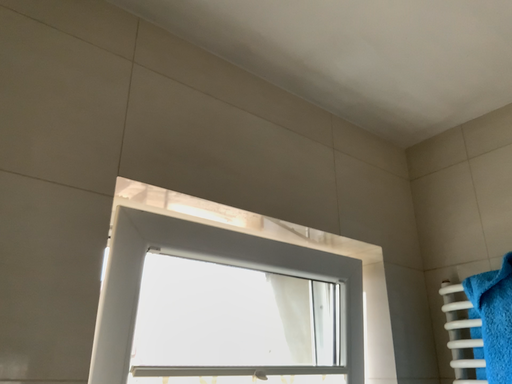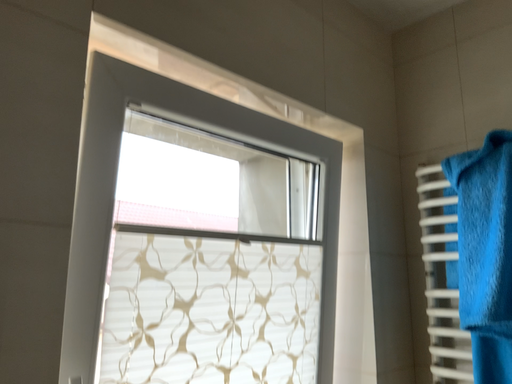
Question: Which way did the camera rotate in the video?

Choices:
 (A) rotated downward
 (B) rotated upward

Answer: (A)